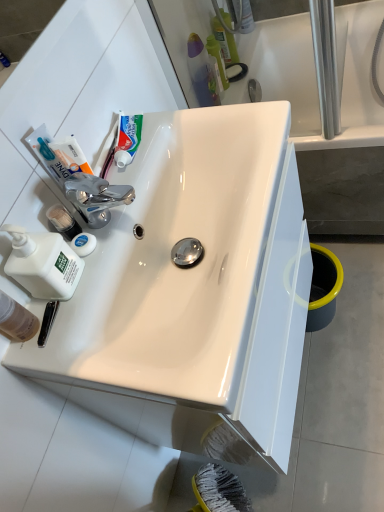
Question: From a real-world perspective, is green matte toothpaste at upper center beneath white glossy bathtub at upper right?

Choices:
 (A) no
 (B) yes

Answer: (A)

Question: From the image's perspective, would you say green matte toothpaste at upper center is shown under white glossy bathtub at upper right?

Choices:
 (A) yes
 (B) no

Answer: (A)

Question: From the image's perspective, is green matte toothpaste at upper center over white glossy bathtub at upper right?

Choices:
 (A) yes
 (B) no

Answer: (B)

Question: Considering the relative sizes of green matte toothpaste at upper center and white glossy bathtub at upper right in the image provided, is green matte toothpaste at upper center taller than white glossy bathtub at upper right?

Choices:
 (A) no
 (B) yes

Answer: (A)

Question: Is green matte toothpaste at upper center shorter than white glossy bathtub at upper right?

Choices:
 (A) no
 (B) yes

Answer: (B)

Question: Does point (208, 52) appear closer or farther from the camera than point (13, 303)?

Choices:
 (A) farther
 (B) closer

Answer: (A)

Question: Looking at the image, does translucent plastic toothbrush at upper center seem bigger or smaller compared to translucent plastic mouthwash at lower left?

Choices:
 (A) big
 (B) small

Answer: (A)

Question: In terms of height, does translucent plastic toothbrush at upper center look taller or shorter compared to translucent plastic mouthwash at lower left?

Choices:
 (A) short
 (B) tall

Answer: (B)

Question: From a real-world perspective, relative to translucent plastic mouthwash at lower left, is translucent plastic toothbrush at upper center vertically above or below?

Choices:
 (A) above
 (B) below

Answer: (B)

Question: Considering the relative positions of translucent plastic toothbrush at upper center and white matte liquid soap at left in the image provided, is translucent plastic toothbrush at upper center to the left or to the right of white matte liquid soap at left?

Choices:
 (A) left
 (B) right

Answer: (B)

Question: Looking at their shapes, would you say translucent plastic toothbrush at upper center is wider or thinner than white matte liquid soap at left?

Choices:
 (A) wide
 (B) thin

Answer: (B)

Question: From the image's perspective, is translucent plastic toothbrush at upper center positioned above or below white matte liquid soap at left?

Choices:
 (A) below
 (B) above

Answer: (B)

Question: Considering the positions of point (218, 54) and point (33, 261), is point (218, 54) closer or farther from the camera than point (33, 261)?

Choices:
 (A) closer
 (B) farther

Answer: (B)

Question: Is white matte liquid soap at left inside the boundaries of translucent plastic toothbrush at upper center, or outside?

Choices:
 (A) inside
 (B) outside

Answer: (B)

Question: From their relative heights in the image, would you say white matte liquid soap at left is taller or shorter than translucent plastic toothbrush at upper center?

Choices:
 (A) short
 (B) tall

Answer: (A)